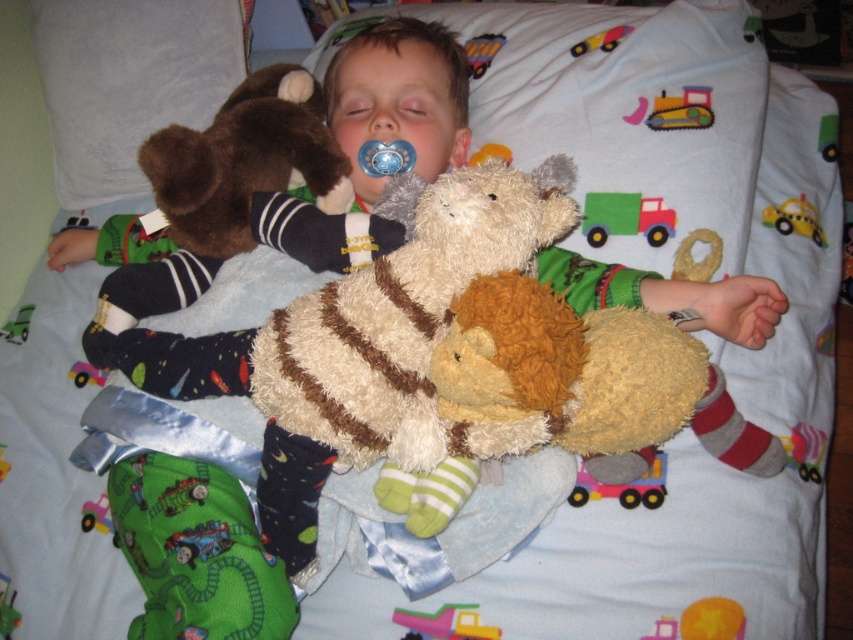
Does green fabric train at lower left appear over plush yellow train at center?

Yes, green fabric train at lower left is above plush yellow train at center.

Measure the distance between point (183, 536) and camera.

Point (183, 536) and camera are 36.60 inches apart.

Is point (210, 554) farther from viewer compared to point (405, 611)?

No, it is not.

Identify the location of green fabric train at lower left. Image resolution: width=853 pixels, height=640 pixels. (196, 552).

Does plush yellow train at center appear on the right side of yellow rubber duck at upper right?

Incorrect, plush yellow train at center is not on the right side of yellow rubber duck at upper right.

Which is above, plush yellow train at center or yellow rubber duck at upper right?

Positioned higher is yellow rubber duck at upper right.

Is point (413, 625) farther from viewer compared to point (809, 234)?

No.

Locate an element on the screen. This screenshot has height=640, width=853. plush yellow train at center is located at coordinates (445, 621).

Is green fabric train at lower left positioned before pink felt truck at center?

Yes, green fabric train at lower left is in front of pink felt truck at center.

You are a GUI agent. You are given a task and a screenshot of the screen. Output one action in this format:
    pyautogui.click(x=<x>, y=<y>)
    Task: Click on the green fabric train at lower left
    Image resolution: width=853 pixels, height=640 pixels.
    Given the screenshot: What is the action you would take?
    pyautogui.click(x=196, y=552)